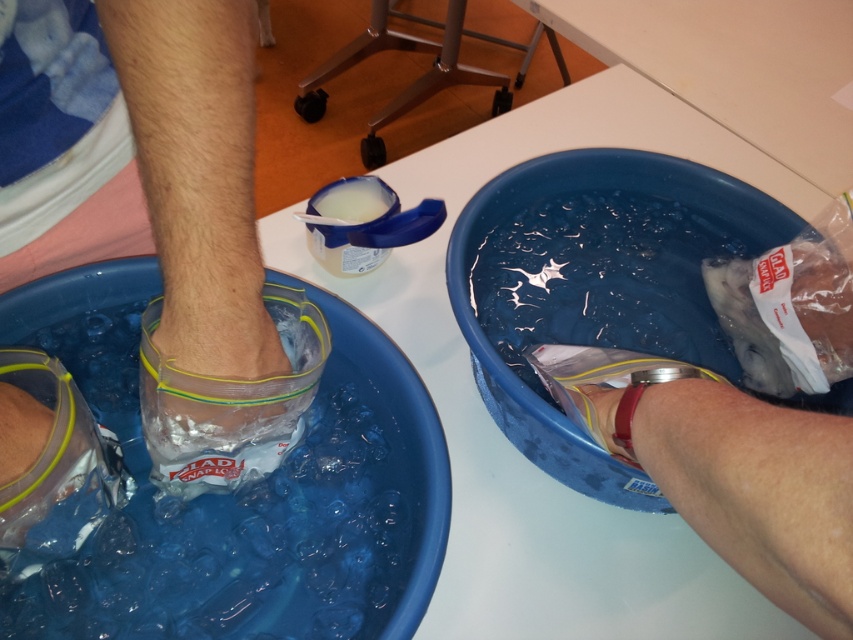
You are a physical therapist assisting a patient in a rehabilitation session. You notice two points marked in the image. The first point is at coordinate point(280, 566) and the second point is at coordinate point(631, 157). Based on their positions, which point is closer to the patient if they are facing the direction of the basins?

Point(280, 566) is in front of point(631, 157), so it is closer to the patient facing the basins.